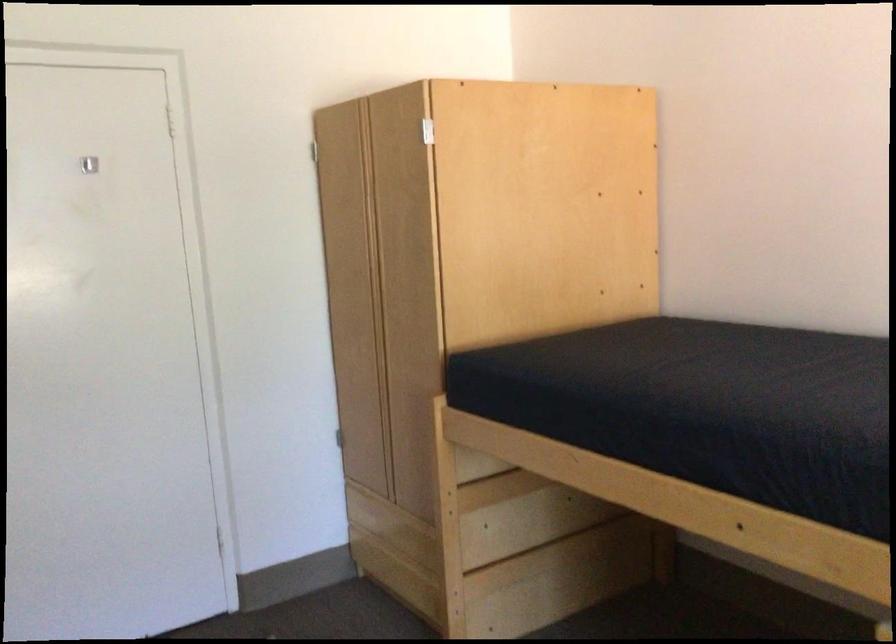
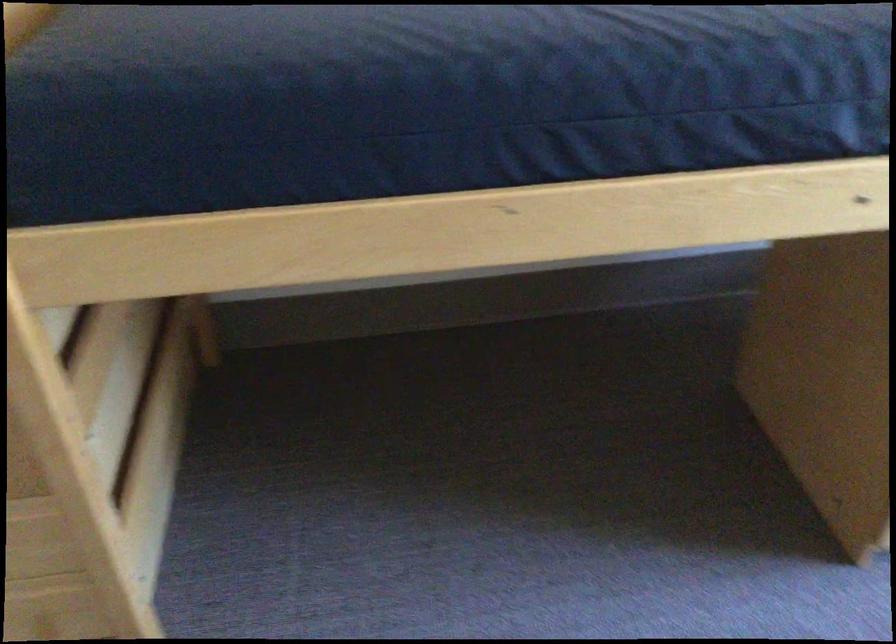
The point at (530,384) is marked in the first image. Where is the corresponding point in the second image?

(280, 106)